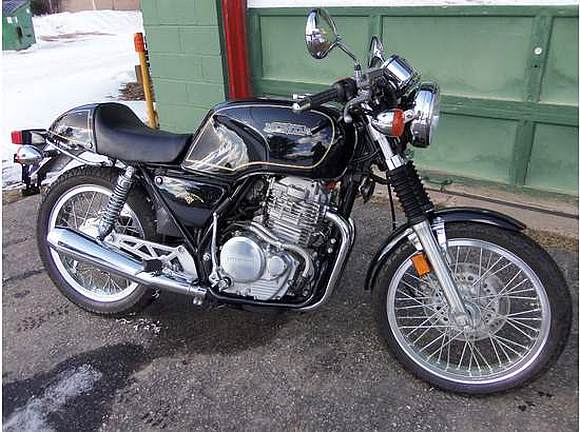
Where is `door garage`? This screenshot has height=432, width=580. door garage is located at coordinates (483, 54).